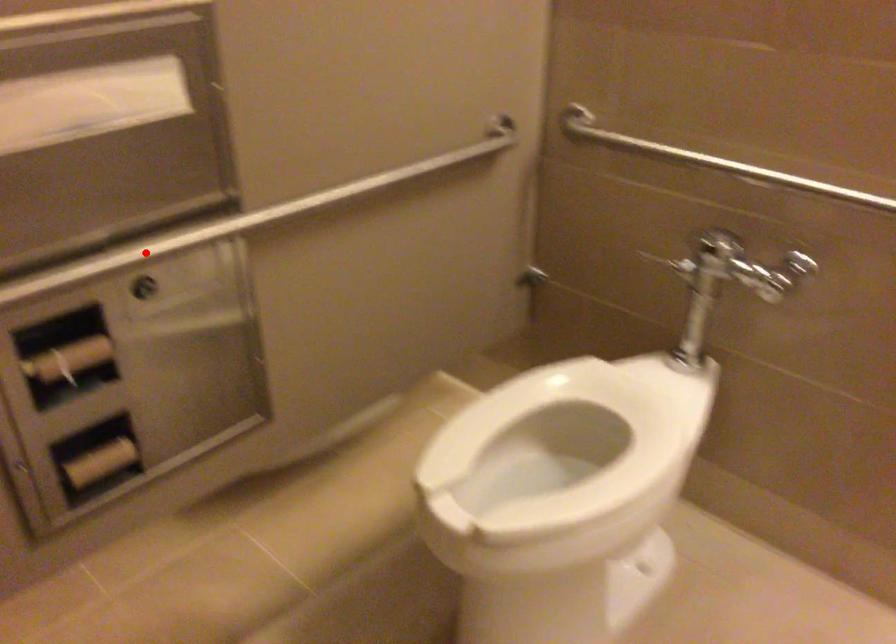
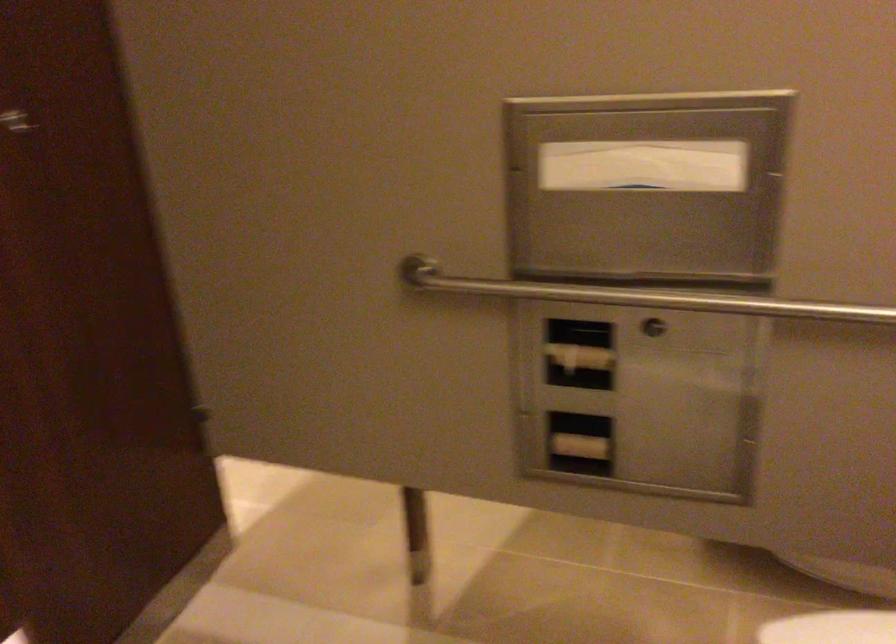
Question: I am providing you with two images of the same scene from different viewpoints. Image1 has a red point marked. In image2, the corresponding 3D location appears at what relative position? Reply with the corresponding letter.

Choices:
 (A) Closer
 (B) Farther

Answer: (B)